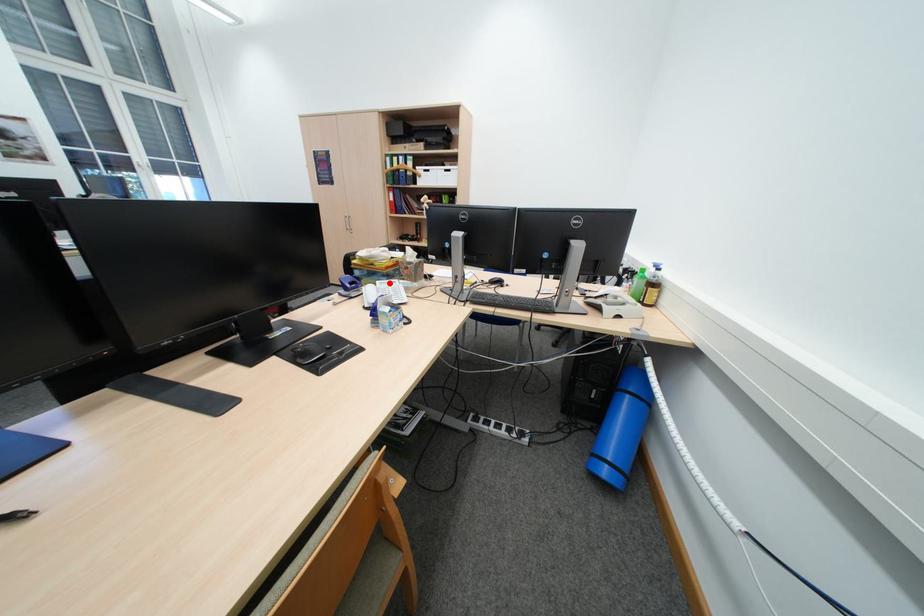
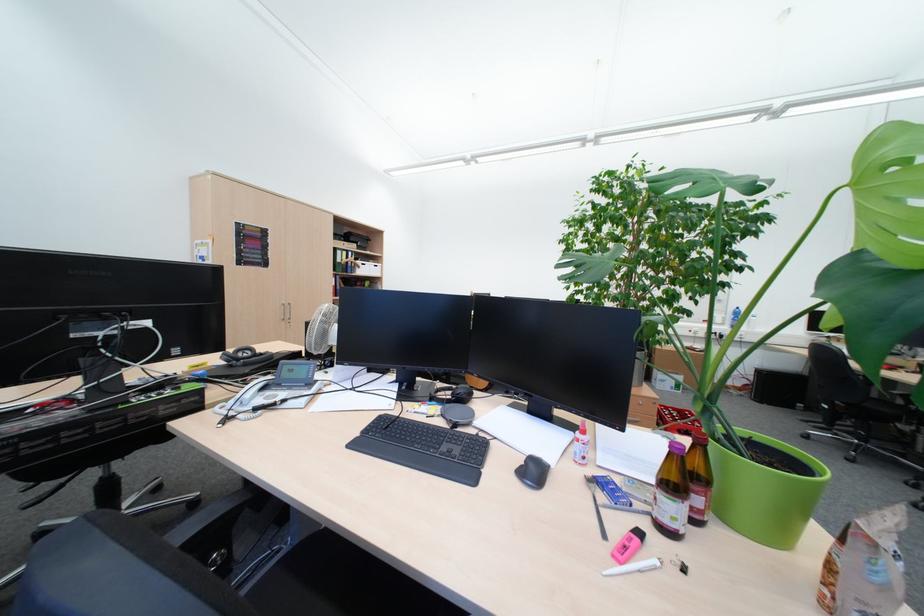
Question: I am providing you with two images of the same scene from different viewpoints. A red point is marked on the first image. Can you still see the location of the red point in image 2?

Choices:
 (A) Yes
 (B) No

Answer: (B)